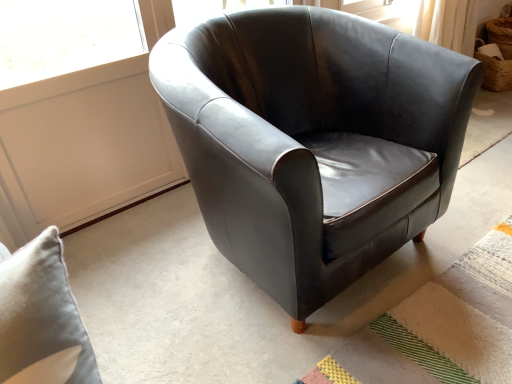
Question: Visually, is matte black armchair at center positioned to the left or to the right of textured woven mat at lower right?

Choices:
 (A) left
 (B) right

Answer: (A)

Question: From their relative heights in the image, would you say matte black armchair at center is taller or shorter than textured woven mat at lower right?

Choices:
 (A) short
 (B) tall

Answer: (B)

Question: Is matte black armchair at center in front of or behind textured woven mat at lower right in the image?

Choices:
 (A) behind
 (B) front

Answer: (B)

Question: From their relative heights in the image, would you say textured woven mat at lower right is taller or shorter than matte black armchair at center?

Choices:
 (A) tall
 (B) short

Answer: (B)

Question: In terms of width, does textured woven mat at lower right look wider or thinner when compared to matte black armchair at center?

Choices:
 (A) wide
 (B) thin

Answer: (A)

Question: Looking at the image, does textured woven mat at lower right seem bigger or smaller compared to matte black armchair at center?

Choices:
 (A) big
 (B) small

Answer: (B)

Question: In the image, is textured woven mat at lower right on the left side or the right side of matte black armchair at center?

Choices:
 (A) left
 (B) right

Answer: (B)